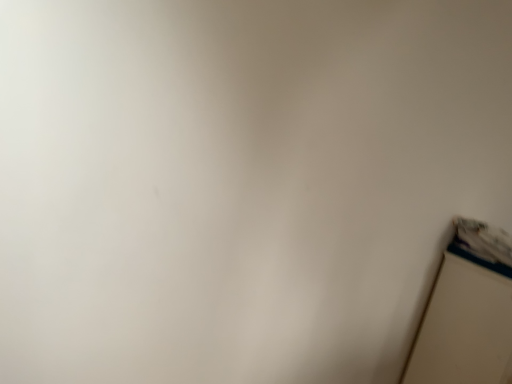
In order to face white matte cabinet at lower right, should I rotate leftwards or rightwards?

Rotate right and turn 29.167 degrees.

Describe the element at coordinates (467, 312) in the screenshot. I see `white matte cabinet at lower right` at that location.

Image resolution: width=512 pixels, height=384 pixels. Identify the location of white matte cabinet at lower right. (467, 312).

Measure the distance between white matte cabinet at lower right and camera.

The depth of white matte cabinet at lower right is 1.66 meters.

Where is `white matte cabinet at lower right`? white matte cabinet at lower right is located at coordinates (467, 312).